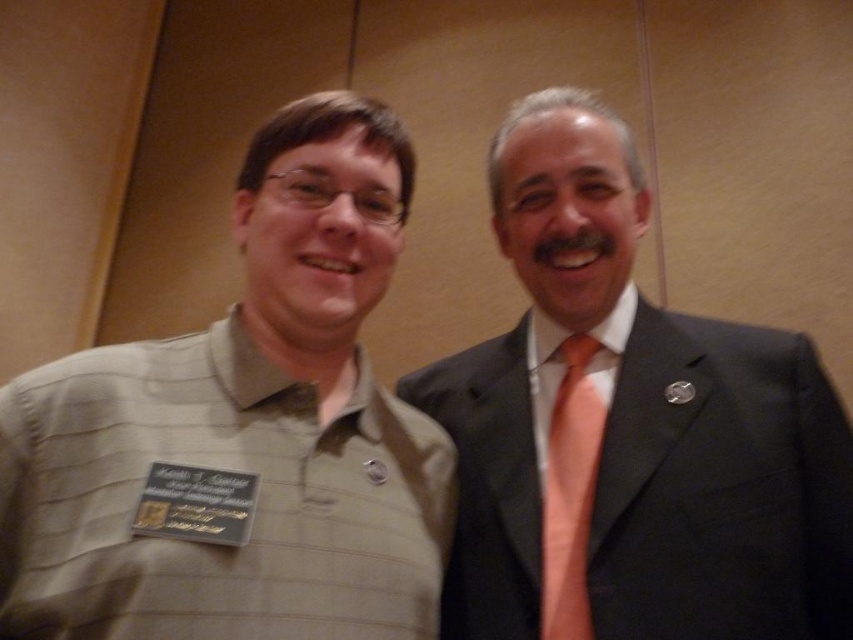
Is matte black suit at right bigger than orange silk tie at right?

Yes, matte black suit at right is bigger than orange silk tie at right.

Is point (450, 385) in front of point (585, 416)?

No, it is behind (585, 416).

Between point (616, 458) and point (577, 477), which one is positioned in front?

Point (616, 458) is in front.

Image resolution: width=853 pixels, height=640 pixels. Find the location of `matte black suit at right`. matte black suit at right is located at coordinates tap(631, 428).

Between point (74, 445) and point (567, 636), which one is positioned behind?

The point (567, 636) is behind.

In the scene shown: Does green striped shirt at center have a larger size compared to orange silk tie at right?

Yes.

This screenshot has height=640, width=853. What do you see at coordinates (241, 433) in the screenshot? I see `green striped shirt at center` at bounding box center [241, 433].

Locate an element on the screen. The width and height of the screenshot is (853, 640). green striped shirt at center is located at coordinates (241, 433).

Between point (260, 291) and point (773, 356), which one is positioned in front?

Point (260, 291) is more forward.

Can you confirm if green striped shirt at center is positioned above matte black suit at right?

Indeed, green striped shirt at center is positioned over matte black suit at right.

Between point (334, 451) and point (788, 365), which one is positioned in front?

Positioned in front is point (334, 451).

At what (x,y) coordinates should I click in order to perform the action: click on green striped shirt at center. Please return your answer as a coordinate pair (x, y). The width and height of the screenshot is (853, 640). Looking at the image, I should click on (241, 433).